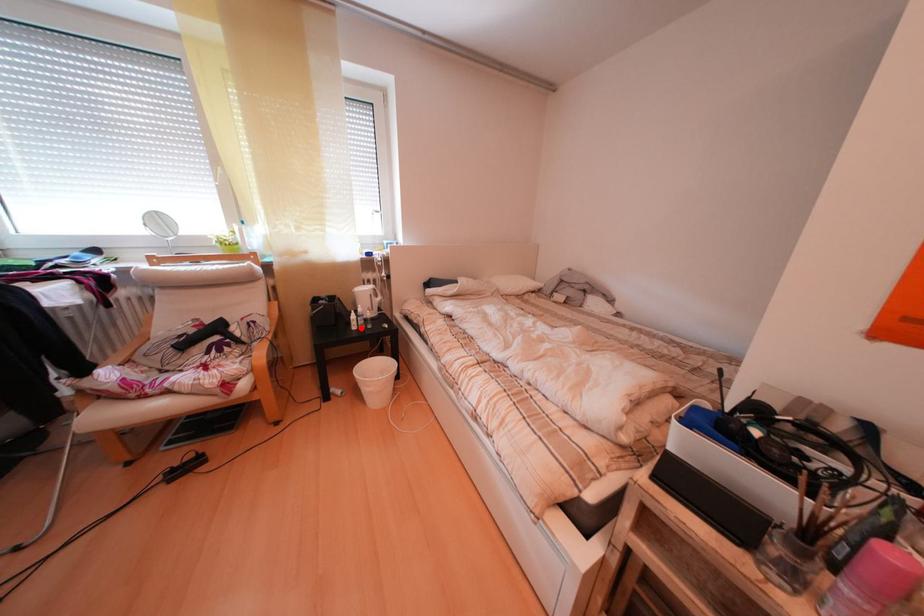
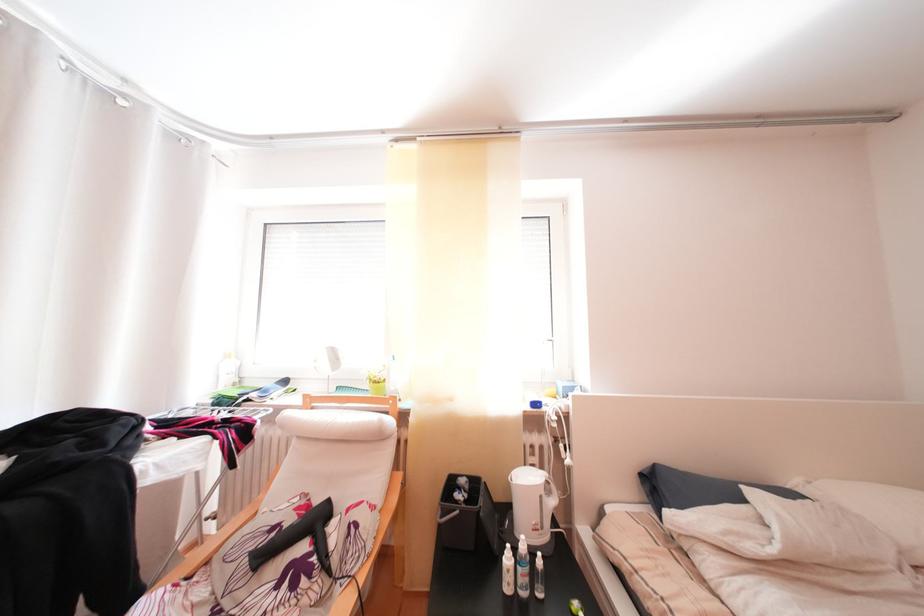
Where in the second image is the point corresponding to the highlighted location from the first image?

(509, 565)